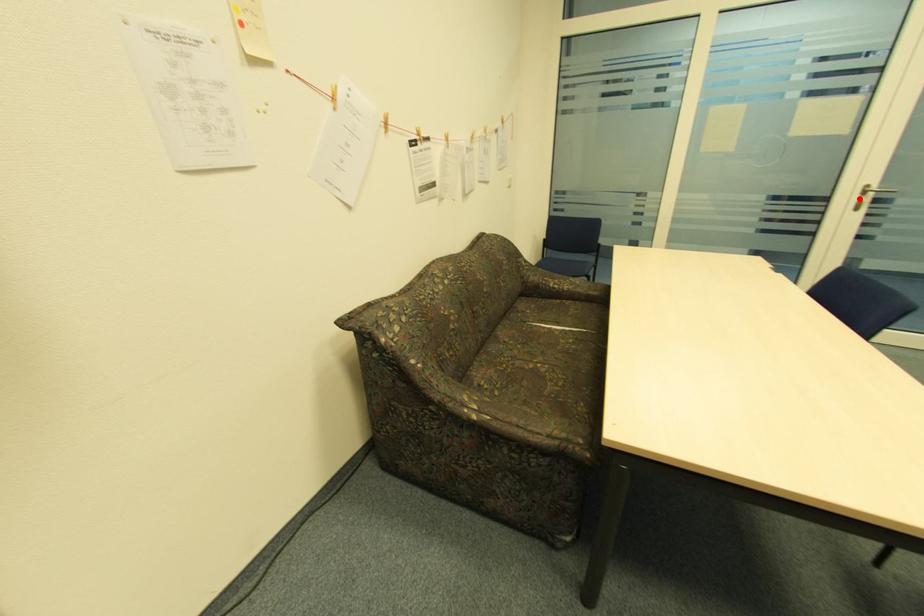
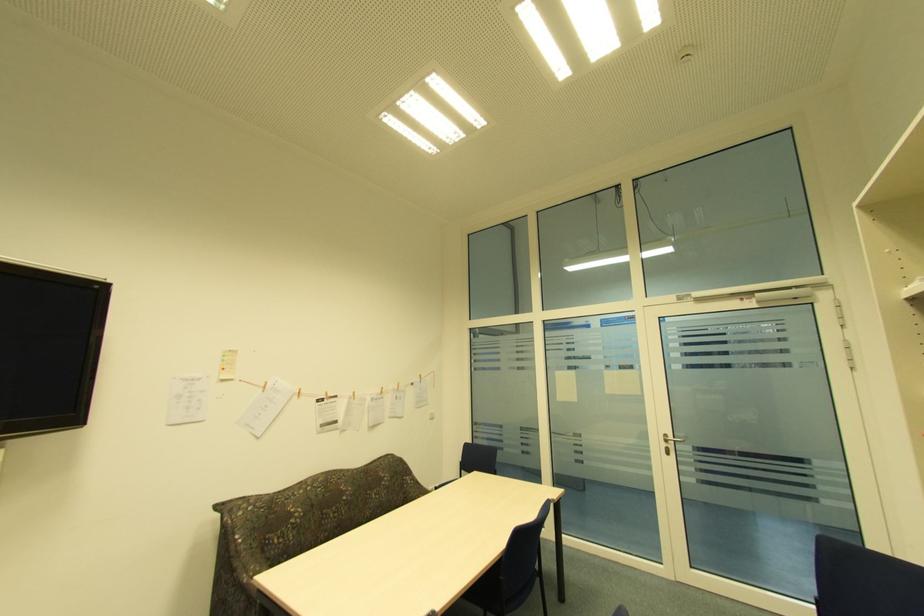
In the second image, find the point that corresponds to the highlighted location in the first image.

(666, 445)